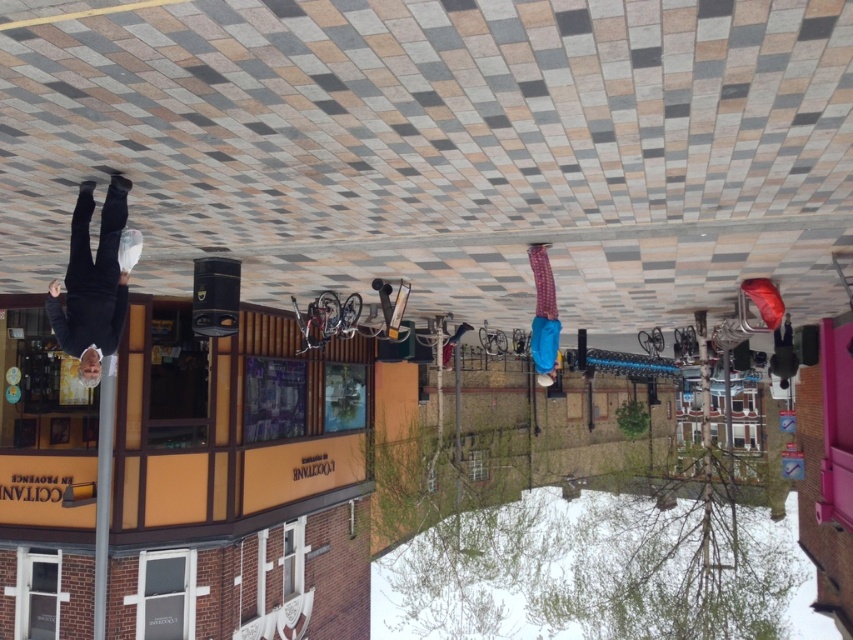
Question: Which point is farther from the camera taking this photo?

Choices:
 (A) (544, 321)
 (B) (99, 272)

Answer: (A)

Question: Can you confirm if black matte pants at left is positioned to the right of plaid fabric pants at center?

Choices:
 (A) yes
 (B) no

Answer: (B)

Question: Which of the following is the farthest from the observer?

Choices:
 (A) (538, 358)
 (B) (115, 182)

Answer: (A)

Question: Does black matte pants at left appear under plaid fabric pants at center?

Choices:
 (A) no
 (B) yes

Answer: (A)

Question: Which of the following is the closest to the observer?

Choices:
 (A) black matte pants at left
 (B) plaid fabric pants at center

Answer: (A)

Question: Is black matte pants at left to the right of plaid fabric pants at center from the viewer's perspective?

Choices:
 (A) yes
 (B) no

Answer: (B)